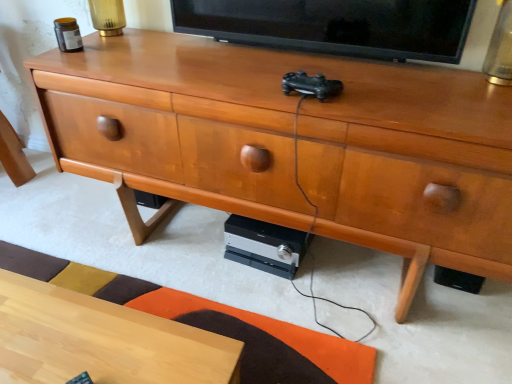
Where is `blank space situated above light wood desk at lower left (from a real-world perspective)`? This screenshot has width=512, height=384. blank space situated above light wood desk at lower left (from a real-world perspective) is located at coordinates (94, 338).